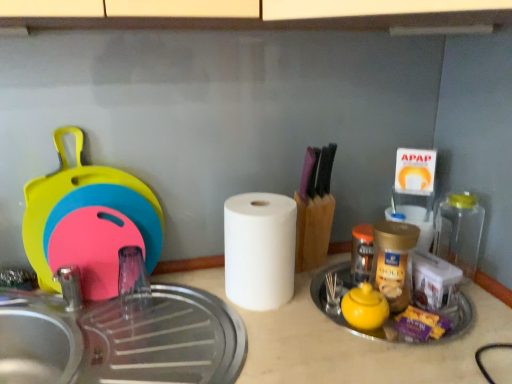
The width and height of the screenshot is (512, 384). Find the location of `white matte paper towel at center, arranged as the 1th paper towel when viewed from the back`. white matte paper towel at center, arranged as the 1th paper towel when viewed from the back is located at coordinates (414, 222).

Image resolution: width=512 pixels, height=384 pixels. I want to click on white matte paper towel at center, placed as the first paper towel when sorted from left to right, so click(x=259, y=250).

The height and width of the screenshot is (384, 512). Describe the element at coordinates (459, 231) in the screenshot. I see `transparent plastic bottle at right, marked as the 3th bottle in a left-to-right arrangement` at that location.

Locate an element on the screen. The image size is (512, 384). yellow matte teapot at center-right is located at coordinates (365, 307).

I want to click on golden plastic jar at center-right, which is the second bottle from right to left, so click(394, 262).

Considering the positions of objects transparent plastic bottle at right, marked as the 3th bottle in a left-to-right arrangement, and transparent plastic faucet at left in the image provided, who is more to the right, transparent plastic bottle at right, marked as the 3th bottle in a left-to-right arrangement, or transparent plastic faucet at left?

Positioned to the right is transparent plastic bottle at right, marked as the 3th bottle in a left-to-right arrangement.

Considering the relative sizes of transparent plastic bottle at right, positioned as the 1th bottle in right-to-left order, and transparent plastic faucet at left in the image provided, is transparent plastic bottle at right, positioned as the 1th bottle in right-to-left order, taller than transparent plastic faucet at left?

Indeed, transparent plastic bottle at right, positioned as the 1th bottle in right-to-left order, has a greater height compared to transparent plastic faucet at left.

Between transparent plastic bottle at right, marked as the 3th bottle in a left-to-right arrangement, and transparent plastic faucet at left, which one has larger width?

transparent plastic bottle at right, marked as the 3th bottle in a left-to-right arrangement.

In order to click on the 1st bottle behind the transparent plastic faucet at left in this screenshot , I will do `click(459, 231)`.

Is transparent plastic faucet at left in front of golden plastic jar at center-right, the second bottle from the left?

No, the depth of transparent plastic faucet at left is greater than that of golden plastic jar at center-right, the second bottle from the left.

Locate an element on the screen. This screenshot has height=384, width=512. faucet below the golden plastic jar at center-right, which is the second bottle from right to left (from the image's perspective) is located at coordinates (133, 282).

From the image's perspective, does transparent plastic faucet at left appear lower than golden plastic jar at center-right, the second bottle from the left?

Yes, from the image's perspective, transparent plastic faucet at left is below golden plastic jar at center-right, the second bottle from the left.

Which of these two, transparent plastic faucet at left or golden plastic jar at center-right, which is the second bottle from right to left, is wider?

With larger width is golden plastic jar at center-right, which is the second bottle from right to left.

Which object is positioned more to the left, transparent plastic faucet at left or translucent plastic bottle at center-right, the third bottle from the right?

transparent plastic faucet at left.

Is transparent plastic faucet at left touching translucent plastic bottle at center-right, the third bottle from the right?

They are not placed beside each other.

From the image's perspective, who appears lower, transparent plastic faucet at left or translucent plastic bottle at center-right, which is the 1th bottle from left to right?

transparent plastic faucet at left appears lower in the image.

From a real-world perspective, is transparent plastic faucet at left beneath translucent plastic bottle at center-right, the third bottle from the right?

Yes, from a real-world perspective, transparent plastic faucet at left is below translucent plastic bottle at center-right, the third bottle from the right.

Is translucent plastic bottle at center-right, the third bottle from the right, to the left of purple plastic candy at lower right from the viewer's perspective?

Answer: Yes, translucent plastic bottle at center-right, the third bottle from the right, is to the left of purple plastic candy at lower right.

Is translucent plastic bottle at center-right, the third bottle from the right, next to purple plastic candy at lower right and touching it?

No, translucent plastic bottle at center-right, the third bottle from the right, is not beside purple plastic candy at lower right.

Is point (366, 258) farther from camera compared to point (415, 337)?

Yes, point (366, 258) is behind point (415, 337).

Is transparent plastic bottle at right, marked as the 3th bottle in a left-to-right arrangement, a part of yellow matte teapot at center-right?

That's incorrect, transparent plastic bottle at right, marked as the 3th bottle in a left-to-right arrangement, is not inside yellow matte teapot at center-right.

Between yellow matte teapot at center-right and transparent plastic bottle at right, positioned as the 1th bottle in right-to-left order, which one has more height?

transparent plastic bottle at right, positioned as the 1th bottle in right-to-left order.

Which object is positioned more to the left, transparent plastic faucet at left or purple plastic candy at lower right?

From the viewer's perspective, transparent plastic faucet at left appears more on the left side.

Which is in front, point (122, 271) or point (439, 335)?

The point (439, 335) is closer to the camera.

The height and width of the screenshot is (384, 512). Find the location of `food located in front of the transparent plastic faucet at left`. food located in front of the transparent plastic faucet at left is located at coordinates (421, 324).

Is transparent plastic faucet at left turned away from purple plastic candy at lower right?

That's not correct — transparent plastic faucet at left is not looking away from purple plastic candy at lower right.

Are white matte paper towel at center, which is the 2th paper towel from right to left, and transparent plastic faucet at left located far from each other?

They are positioned close to each other.

From the image's perspective, which object appears higher, white matte paper towel at center, which is the 2th paper towel from right to left, or transparent plastic faucet at left?

From the image's view, white matte paper towel at center, which is the 2th paper towel from right to left, is above.

Is transparent plastic faucet at left inside white matte paper towel at center, arranged as the second paper towel when viewed from the back?

Definitely not — transparent plastic faucet at left is not inside white matte paper towel at center, arranged as the second paper towel when viewed from the back.

From a real-world perspective, between white matte paper towel at center, which is the 2th paper towel from right to left, and transparent plastic faucet at left, who is vertically higher?

white matte paper towel at center, which is the 2th paper towel from right to left, from a real-world perspective.

Starting from the transparent plastic faucet at left, which bottle is the 1st one behind? Please provide its 2D coordinates.

[(459, 231)]

Identify the location of faucet that is below the golden plastic jar at center-right, which is the second bottle from right to left (from the image's perspective). This screenshot has width=512, height=384. (133, 282).

Estimate the real-world distances between objects in this image. Which object is further from white matte paper towel at center, which is the 2th paper towel from right to left, purple plastic candy at lower right or transparent plastic faucet at left?

Based on the image, purple plastic candy at lower right appears to be further to white matte paper towel at center, which is the 2th paper towel from right to left.

Which object lies further to the anchor point white matte paper towel at center, marked as the 1th paper towel in a front-to-back arrangement, transparent plastic bottle at right, marked as the 3th bottle in a left-to-right arrangement, or golden plastic jar at center-right, which is the second bottle from right to left?

transparent plastic bottle at right, marked as the 3th bottle in a left-to-right arrangement, is positioned further to the anchor white matte paper towel at center, marked as the 1th paper towel in a front-to-back arrangement.

Estimate the real-world distances between objects in this image. Which object is further from purple plastic candy at lower right, white matte paper towel at center, arranged as the second paper towel when viewed from the back, or white matte paper towel at center, the 2th paper towel viewed from the front?

Based on the image, white matte paper towel at center, arranged as the second paper towel when viewed from the back, appears to be further to purple plastic candy at lower right.

When comparing their distances from white matte paper towel at center, marked as the 1th paper towel in a front-to-back arrangement, does white matte paper towel at center, the 2th paper towel viewed from the front, or purple plastic candy at lower right seem closer?

Based on the image, purple plastic candy at lower right appears to be nearer to white matte paper towel at center, marked as the 1th paper towel in a front-to-back arrangement.

When comparing their distances from purple plastic candy at lower right, does translucent plastic bottle at center-right, which is the 1th bottle from left to right, or white matte paper towel at center, which is the 2th paper towel from right to left, seem further?

Among the two, white matte paper towel at center, which is the 2th paper towel from right to left, is located further to purple plastic candy at lower right.

Estimate the real-world distances between objects in this image. Which object is further from white matte paper towel at center, the 2th paper towel from the left, translucent plastic bottle at center-right, the third bottle from the right, or golden plastic jar at center-right, the second bottle from the left?

golden plastic jar at center-right, the second bottle from the left, is further to white matte paper towel at center, the 2th paper towel from the left.

Which object lies further to the anchor point purple plastic candy at lower right, translucent plastic bottle at center-right, which is the 1th bottle from left to right, or golden plastic jar at center-right, which is the second bottle from right to left?

translucent plastic bottle at center-right, which is the 1th bottle from left to right, is positioned further to the anchor purple plastic candy at lower right.

Which object lies nearer to the anchor point transparent plastic bottle at right, marked as the 3th bottle in a left-to-right arrangement, transparent plastic faucet at left or purple plastic candy at lower right?

purple plastic candy at lower right.

This screenshot has width=512, height=384. Find the location of `food situated between white matte paper towel at center, arranged as the second paper towel when viewed from the back, and transparent plastic bottle at right, positioned as the 1th bottle in right-to-left order, from left to right`. food situated between white matte paper towel at center, arranged as the second paper towel when viewed from the back, and transparent plastic bottle at right, positioned as the 1th bottle in right-to-left order, from left to right is located at coordinates (421, 324).

Image resolution: width=512 pixels, height=384 pixels. I want to click on food between golden plastic jar at center-right, the second bottle from the left, and transparent plastic bottle at right, positioned as the 1th bottle in right-to-left order, so click(x=421, y=324).

The image size is (512, 384). I want to click on tea pot between white matte paper towel at center, which is the 2th paper towel from right to left, and translucent plastic bottle at center-right, which is the 1th bottle from left to right, from left to right, so click(x=365, y=307).

You are a GUI agent. You are given a task and a screenshot of the screen. Output one action in this format:
    pyautogui.click(x=<x>, y=<y>)
    Task: Click on the paper towel located between transparent plastic faucet at left and yellow matte teapot at center-right in the left-right direction
    The image size is (512, 384).
    Given the screenshot: What is the action you would take?
    pyautogui.click(x=259, y=250)